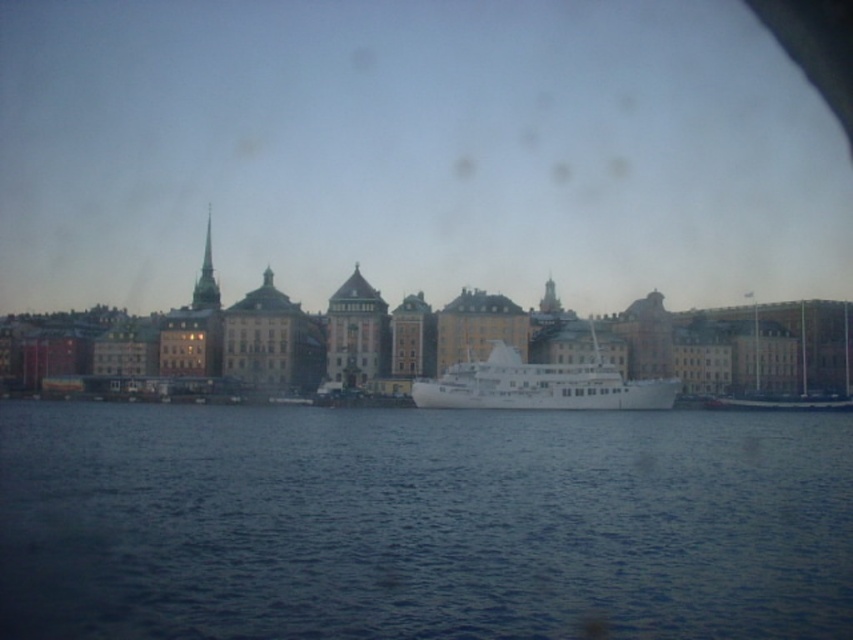
You are an observer standing at the waterfront. You notice the blue liquid water at center and the white glossy ship at center. Which object appears taller from your viewpoint?

The white glossy ship at center appears taller than the blue liquid water at center because the blue liquid water at center is shorter than the white glossy ship at center.

You are standing at the waterfront and want to take a photo of both the blue liquid water at center and the white glossy ship at center. Which object should you focus on first if you want both to be in sharp focus?

Since the blue liquid water at center is closer to the viewer than the white glossy ship at center, you should focus on the white glossy ship at center first. This is because focusing on the farther object allows the closer object to still be within the depth of field, ensuring both are in focus.